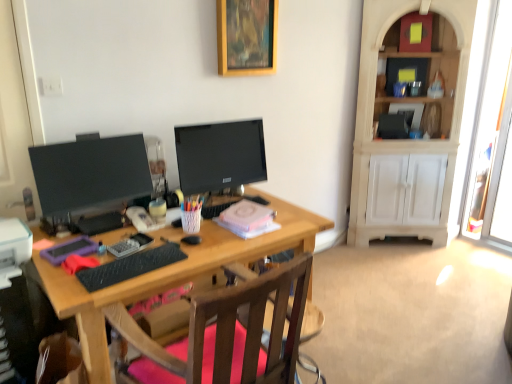
Question: Does wooden picture frame at upper center appear on the left side of purple matte case at left, which is the 3th stationery in right-to-left order?

Choices:
 (A) yes
 (B) no

Answer: (B)

Question: Considering the relative sizes of wooden picture frame at upper center and purple matte case at left, placed as the 1th stationery when sorted from left to right, in the image provided, is wooden picture frame at upper center thinner than purple matte case at left, placed as the 1th stationery when sorted from left to right,?

Choices:
 (A) yes
 (B) no

Answer: (A)

Question: From the image's perspective, would you say wooden picture frame at upper center is positioned over purple matte case at left, which is the 3th stationery in right-to-left order?

Choices:
 (A) yes
 (B) no

Answer: (A)

Question: Considering the relative sizes of wooden picture frame at upper center and purple matte case at left, which is the 3th stationery in right-to-left order, in the image provided, is wooden picture frame at upper center bigger than purple matte case at left, which is the 3th stationery in right-to-left order,?

Choices:
 (A) yes
 (B) no

Answer: (A)

Question: Is wooden picture frame at upper center not within purple matte case at left, which is the 3th stationery in right-to-left order?

Choices:
 (A) yes
 (B) no

Answer: (A)

Question: Is wooden picture frame at upper center looking in the opposite direction of purple matte case at left, which is the 3th stationery in right-to-left order?

Choices:
 (A) yes
 (B) no

Answer: (B)

Question: Is purple matte case at left, placed as the 1th stationery when sorted from left to right, thinner than white woven pen holder at center, acting as the 1th stationery starting from the right?

Choices:
 (A) no
 (B) yes

Answer: (A)

Question: From a real-world perspective, does purple matte case at left, which is the 3th stationery in right-to-left order, stand above white woven pen holder at center, acting as the 1th stationery starting from the right?

Choices:
 (A) yes
 (B) no

Answer: (B)

Question: Is white woven pen holder at center, the third stationery in the left-to-right sequence, inside purple matte case at left, which is the 3th stationery in right-to-left order?

Choices:
 (A) no
 (B) yes

Answer: (A)

Question: Considering the relative positions of purple matte case at left, placed as the 1th stationery when sorted from left to right, and white woven pen holder at center, acting as the 1th stationery starting from the right, in the image provided, is purple matte case at left, placed as the 1th stationery when sorted from left to right, to the left of white woven pen holder at center, acting as the 1th stationery starting from the right, from the viewer's perspective?

Choices:
 (A) no
 (B) yes

Answer: (B)

Question: Does purple matte case at left, placed as the 1th stationery when sorted from left to right, have a smaller size compared to white woven pen holder at center, acting as the 1th stationery starting from the right?

Choices:
 (A) no
 (B) yes

Answer: (A)

Question: Can you see purple matte case at left, which is the 3th stationery in right-to-left order, touching white woven pen holder at center, acting as the 1th stationery starting from the right?

Choices:
 (A) no
 (B) yes

Answer: (A)

Question: Is black rubberized keyboard at center far from purple matte case at left, which is the 3th stationery in right-to-left order?

Choices:
 (A) yes
 (B) no

Answer: (B)